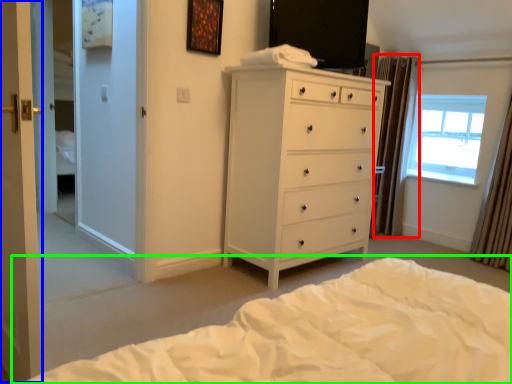
Question: Based on their relative distances, which object is farther from curtain (highlighted by a red box)? Choose from screen door (highlighted by a blue box) and bed (highlighted by a green box).

Choices:
 (A) screen door
 (B) bed

Answer: (A)